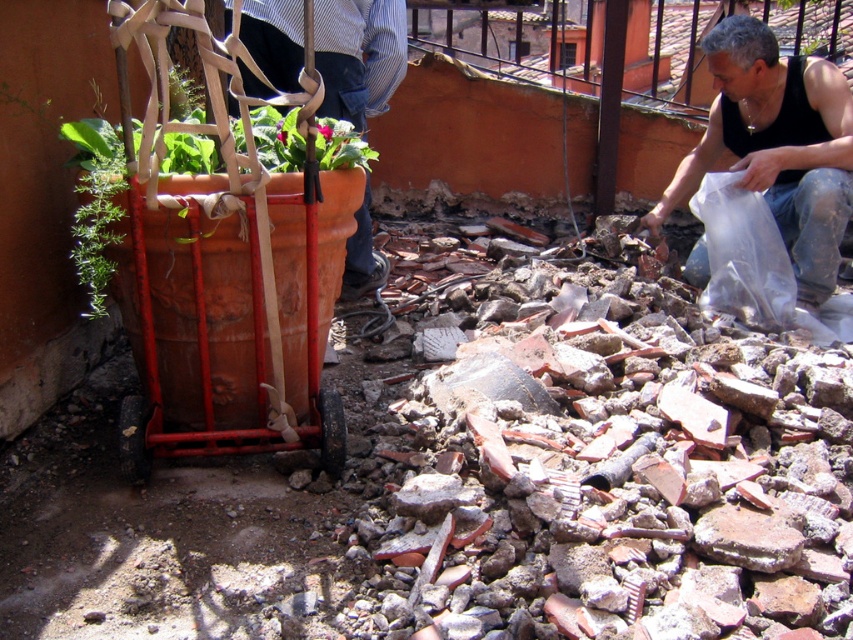
Question: Which object is the farthest from the terracotta clay cart at left?

Choices:
 (A) black tank top at lower right
 (B) striped shirt at upper center

Answer: (A)

Question: Considering the real-world distances, which object is farthest from the terracotta clay cart at left?

Choices:
 (A) black tank top at lower right
 (B) striped shirt at upper center

Answer: (A)

Question: Observing the image, what is the correct spatial positioning of black tank top at lower right in reference to striped shirt at upper center?

Choices:
 (A) above
 (B) below

Answer: (B)

Question: Where is black tank top at lower right located in relation to striped shirt at upper center in the image?

Choices:
 (A) below
 (B) above

Answer: (A)

Question: Which is farther from the terracotta clay cart at left?

Choices:
 (A) striped shirt at upper center
 (B) black tank top at lower right

Answer: (B)

Question: Can you confirm if terracotta clay cart at left is bigger than striped shirt at upper center?

Choices:
 (A) yes
 (B) no

Answer: (A)